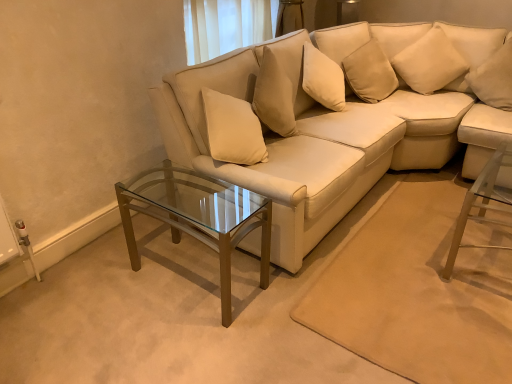
Question: From a real-world perspective, is white soft pillow at upper right, which is the 2th pillow from left to right, positioned over soft beige pillow at upper right, the 1th pillow when ordered from left to right, based on gravity?

Choices:
 (A) no
 (B) yes

Answer: (A)

Question: Is white soft pillow at upper right, the first pillow when ordered from right to left, touching soft beige pillow at upper right, the 1th pillow when ordered from left to right?

Choices:
 (A) no
 (B) yes

Answer: (A)

Question: Would you say white soft pillow at upper right, the first pillow when ordered from right to left, is outside soft beige pillow at upper right, the 2th pillow viewed from the right?

Choices:
 (A) no
 (B) yes

Answer: (B)

Question: Does white soft pillow at upper right, which is the 2th pillow from left to right, have a larger size compared to soft beige pillow at upper right, the 2th pillow viewed from the right?

Choices:
 (A) no
 (B) yes

Answer: (A)

Question: Does white soft pillow at upper right, the first pillow when ordered from right to left, lie behind soft beige pillow at upper right, the 1th pillow when ordered from left to right?

Choices:
 (A) yes
 (B) no

Answer: (B)

Question: In terms of width, does soft beige pillow at upper right, the 1th pillow when ordered from left to right, look wider or thinner when compared to white soft pillow at upper right, the first pillow when ordered from right to left?

Choices:
 (A) thin
 (B) wide

Answer: (A)

Question: Is soft beige pillow at upper right, the 1th pillow when ordered from left to right, bigger or smaller than white soft pillow at upper right, which is the 2th pillow from left to right?

Choices:
 (A) small
 (B) big

Answer: (B)

Question: Is soft beige pillow at upper right, the 2th pillow viewed from the right, inside the boundaries of white soft pillow at upper right, which is the 2th pillow from left to right, or outside?

Choices:
 (A) inside
 (B) outside

Answer: (B)

Question: Is soft beige pillow at upper right, the 1th pillow when ordered from left to right, taller or shorter than white soft pillow at upper right, the first pillow when ordered from right to left?

Choices:
 (A) tall
 (B) short

Answer: (A)

Question: Would you say clear glass coffee table at center is to the left or to the right of soft beige pillow at upper right, the 1th pillow when ordered from left to right, in the picture?

Choices:
 (A) left
 (B) right

Answer: (A)

Question: Considering the positions of clear glass coffee table at center and soft beige pillow at upper right, the 1th pillow when ordered from left to right, in the image, is clear glass coffee table at center wider or thinner than soft beige pillow at upper right, the 1th pillow when ordered from left to right,?

Choices:
 (A) wide
 (B) thin

Answer: (A)

Question: From a real-world perspective, is clear glass coffee table at center above or below soft beige pillow at upper right, the 2th pillow viewed from the right?

Choices:
 (A) below
 (B) above

Answer: (A)

Question: Based on their sizes in the image, would you say clear glass coffee table at center is bigger or smaller than soft beige pillow at upper right, the 1th pillow when ordered from left to right?

Choices:
 (A) big
 (B) small

Answer: (A)

Question: Visually, is soft beige pillow at upper right, the 2th pillow viewed from the right, positioned to the left or to the right of clear glass coffee table at center?

Choices:
 (A) right
 (B) left

Answer: (A)

Question: Relative to clear glass coffee table at center, is soft beige pillow at upper right, the 1th pillow when ordered from left to right, in front or behind?

Choices:
 (A) behind
 (B) front

Answer: (A)